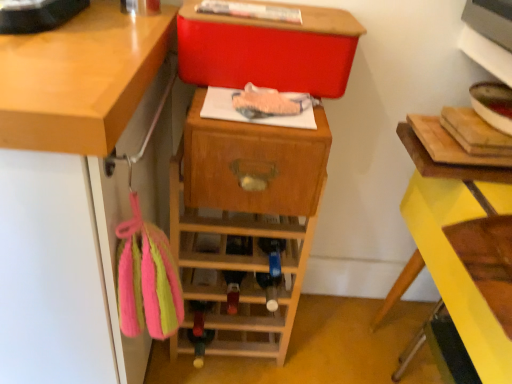
Question: Is yellow painted wood at right positioned with its back to wooden wine rack at center?

Choices:
 (A) no
 (B) yes

Answer: (A)

Question: Is yellow painted wood at right to the left of wooden wine rack at center from the viewer's perspective?

Choices:
 (A) yes
 (B) no

Answer: (B)

Question: From a real-world perspective, is yellow painted wood at right positioned over wooden wine rack at center based on gravity?

Choices:
 (A) yes
 (B) no

Answer: (A)

Question: From a real-world perspective, is yellow painted wood at right physically below wooden wine rack at center?

Choices:
 (A) yes
 (B) no

Answer: (B)

Question: Could you tell me if yellow painted wood at right is turned towards wooden wine rack at center?

Choices:
 (A) no
 (B) yes

Answer: (B)

Question: Is yellow painted wood at right smaller than wooden wine rack at center?

Choices:
 (A) yes
 (B) no

Answer: (B)

Question: Is yellow painted wood at right further to camera compared to matte red storage box at upper center?

Choices:
 (A) no
 (B) yes

Answer: (A)

Question: From a real-world perspective, is yellow painted wood at right located higher than matte red storage box at upper center?

Choices:
 (A) yes
 (B) no

Answer: (B)

Question: Is yellow painted wood at right next to matte red storage box at upper center?

Choices:
 (A) no
 (B) yes

Answer: (A)

Question: From a real-world perspective, does yellow painted wood at right sit lower than matte red storage box at upper center?

Choices:
 (A) no
 (B) yes

Answer: (B)

Question: Does yellow painted wood at right appear on the left side of matte red storage box at upper center?

Choices:
 (A) yes
 (B) no

Answer: (B)

Question: Does yellow painted wood at right appear on the right side of matte red storage box at upper center?

Choices:
 (A) no
 (B) yes

Answer: (B)

Question: Is wooden drawer at center wider than matte red storage box at upper center?

Choices:
 (A) no
 (B) yes

Answer: (A)